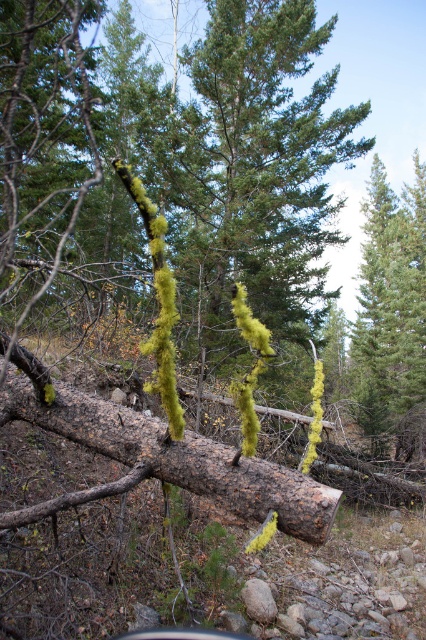
Question: Which point is farther from the camera taking this photo?

Choices:
 (A) (417, 168)
 (B) (106, 454)

Answer: (A)

Question: Which point appears farthest from the camera in this image?

Choices:
 (A) (425, 300)
 (B) (163, 435)

Answer: (A)

Question: Can you confirm if rusty bark log at center is bigger than green lichen-covered tree at right?

Choices:
 (A) yes
 (B) no

Answer: (B)

Question: Where is rusty bark log at center located in relation to green lichen-covered tree at right in the image?

Choices:
 (A) below
 (B) above

Answer: (A)

Question: Is rusty bark log at center to the right of green lichen-covered tree at right from the viewer's perspective?

Choices:
 (A) yes
 (B) no

Answer: (B)

Question: Among these objects, which one is nearest to the camera?

Choices:
 (A) rusty bark log at center
 (B) green lichen-covered tree at right

Answer: (A)